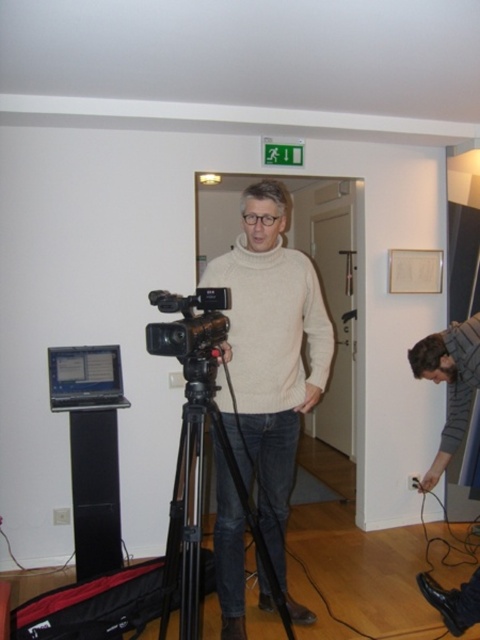
Is black matte tripod at center smaller than black plastic camera at center?

No.

Is black matte tripod at center below black plastic camera at center?

Yes, black matte tripod at center is below black plastic camera at center.

Which is in front, point (224, 444) or point (162, 339)?

Point (162, 339) is in front.

Find the location of a particular element. The height and width of the screenshot is (640, 480). black matte tripod at center is located at coordinates (201, 497).

Is point (468, 400) in front of point (191, 333)?

No, it is not.

From the picture: Can you confirm if striped sweater at lower right is positioned below black plastic camera at center?

Yes, striped sweater at lower right is below black plastic camera at center.

The image size is (480, 640). What do you see at coordinates (450, 384) in the screenshot?
I see `striped sweater at lower right` at bounding box center [450, 384].

The image size is (480, 640). I want to click on striped sweater at lower right, so click(450, 384).

Between light beige sweater at center and black matte tripod at center, which one appears on the right side from the viewer's perspective?

light beige sweater at center

Locate an element on the screen. The width and height of the screenshot is (480, 640). light beige sweater at center is located at coordinates (269, 358).

Which is behind, point (275, 266) or point (206, 384)?

Point (275, 266)

Find the location of a particular element. This screenshot has height=640, width=480. light beige sweater at center is located at coordinates (269, 358).